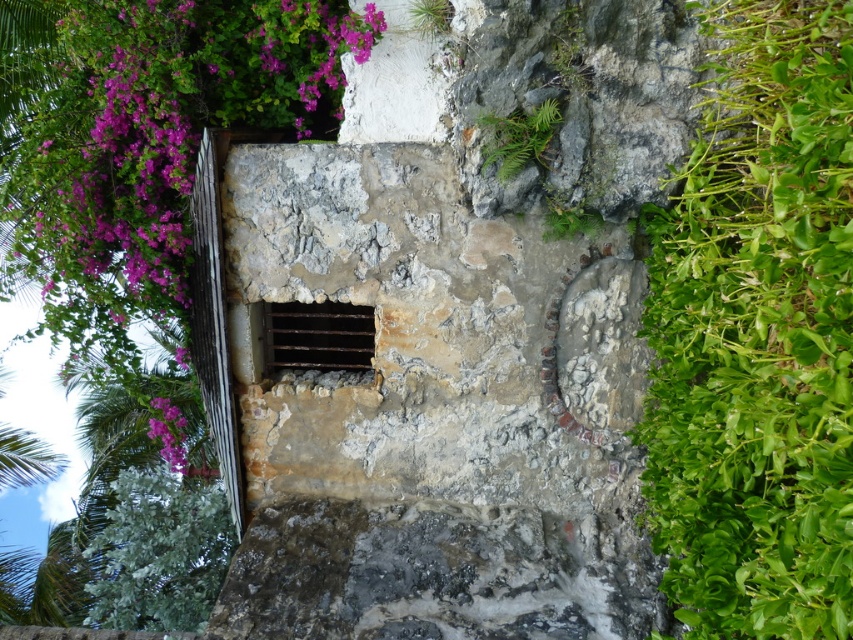
Can you confirm if green leafy plant at right is positioned to the left of purple matte flower at upper left?

Incorrect, green leafy plant at right is not on the left side of purple matte flower at upper left.

Does green leafy plant at right have a lesser height compared to purple matte flower at upper left?

No, green leafy plant at right is not shorter than purple matte flower at upper left.

Locate an element on the screen. Image resolution: width=853 pixels, height=640 pixels. green leafy plant at right is located at coordinates (757, 333).

Locate an element on the screen. green leafy plant at right is located at coordinates (757, 333).